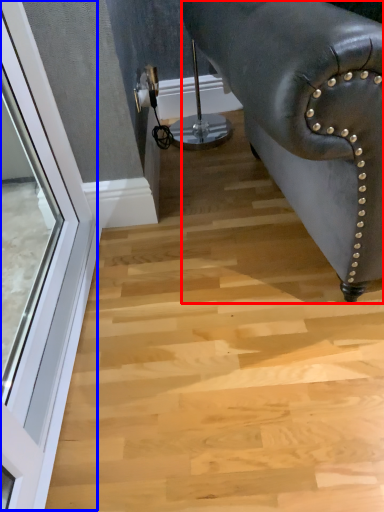
Question: Which of the following is the farthest to the observer, furniture (highlighted by a red box) or window (highlighted by a blue box)?

Choices:
 (A) furniture
 (B) window

Answer: (B)